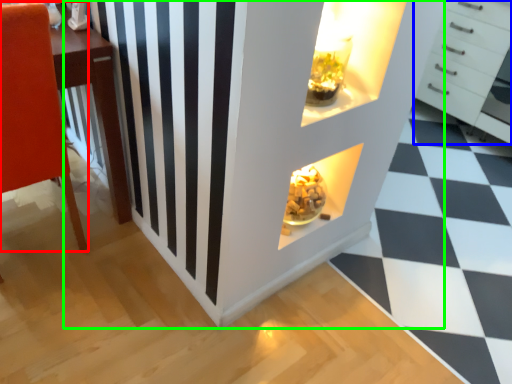
Question: Which object is the farthest from furniture (highlighted by a red box)? Choose among these: chest of drawers (highlighted by a blue box) or dresser (highlighted by a green box).

Choices:
 (A) chest of drawers
 (B) dresser

Answer: (A)